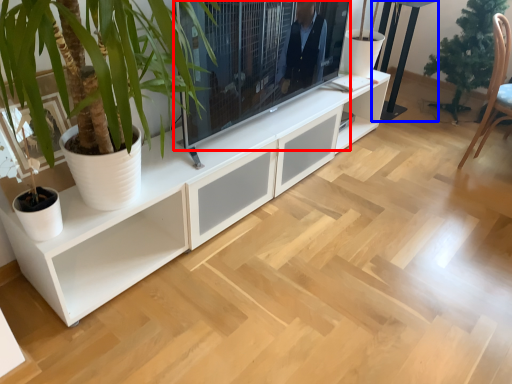
Question: Among these objects, which one is nearest to the camera, television (highlighted by a red box) or table (highlighted by a blue box)?

Choices:
 (A) television
 (B) table

Answer: (A)